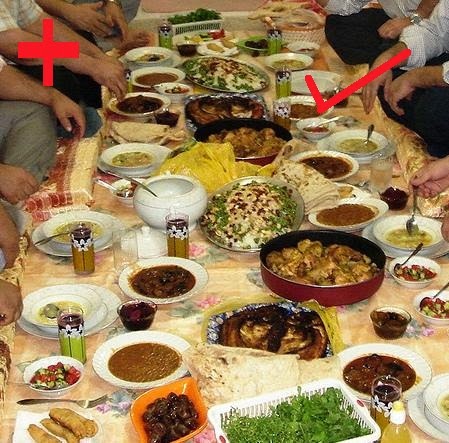
At what (x,y) coordinates should I click in order to perform the action: click on knob on top of tureen lid. Please return your answer as a coordinate pair (x, y). The width and height of the screenshot is (449, 443). Looking at the image, I should click on (145, 230).